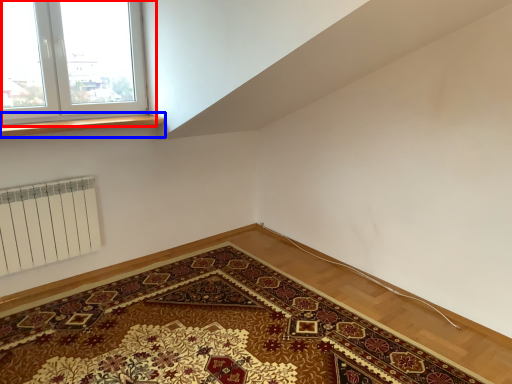
Question: Which object appears farthest to the camera in this image, window (highlighted by a red box) or window sill (highlighted by a blue box)?

Choices:
 (A) window
 (B) window sill

Answer: (B)